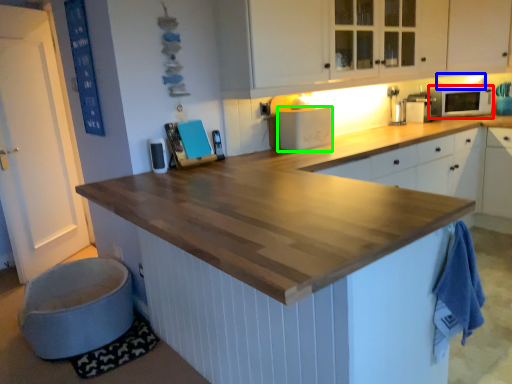
Question: Which is nearer to the microwave oven (highlighted by a red box)? exhaust hood (highlighted by a blue box) or appliance (highlighted by a green box).

Choices:
 (A) exhaust hood
 (B) appliance

Answer: (A)